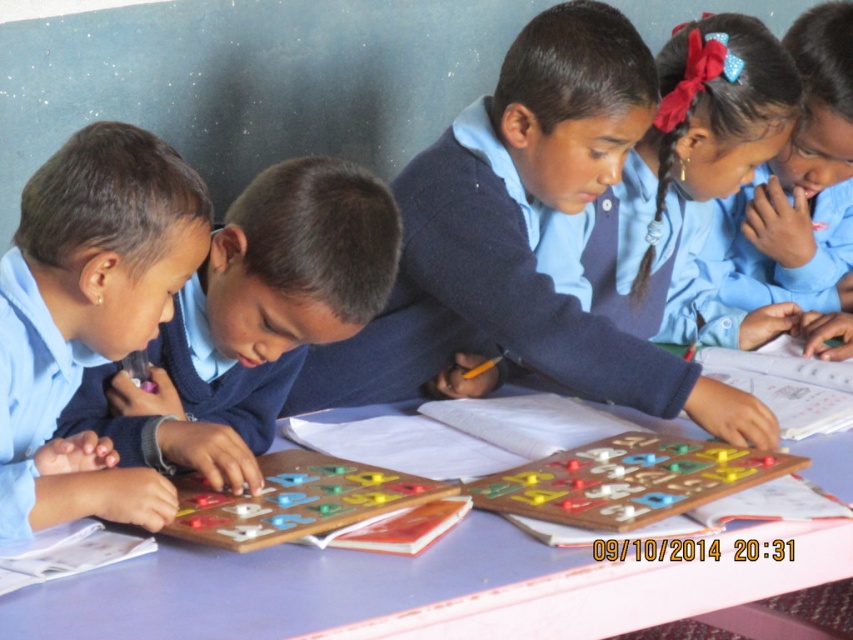
Question: Which object appears farthest from the camera in this image?

Choices:
 (A) purple plastic table at center
 (B) matte blue uniform at center

Answer: (B)

Question: Observing the image, what is the correct spatial positioning of blue uniform shirt at center in reference to blue uniform at center?

Choices:
 (A) left
 (B) right

Answer: (A)

Question: Can you confirm if matte blue uniform at center is thinner than blue uniform at center?

Choices:
 (A) no
 (B) yes

Answer: (B)

Question: Is matte blue uniform at center positioned at the back of blue uniform at upper right?

Choices:
 (A) yes
 (B) no

Answer: (B)

Question: Which object is the closest to the blue uniform at center?

Choices:
 (A) purple plastic table at center
 (B) wooden game board at center
 (C) wooden board game at center

Answer: (C)

Question: Which point is farther to the camera?

Choices:
 (A) (735, 202)
 (B) (608, 252)
 (C) (297, 496)
 (D) (491, 166)

Answer: (A)